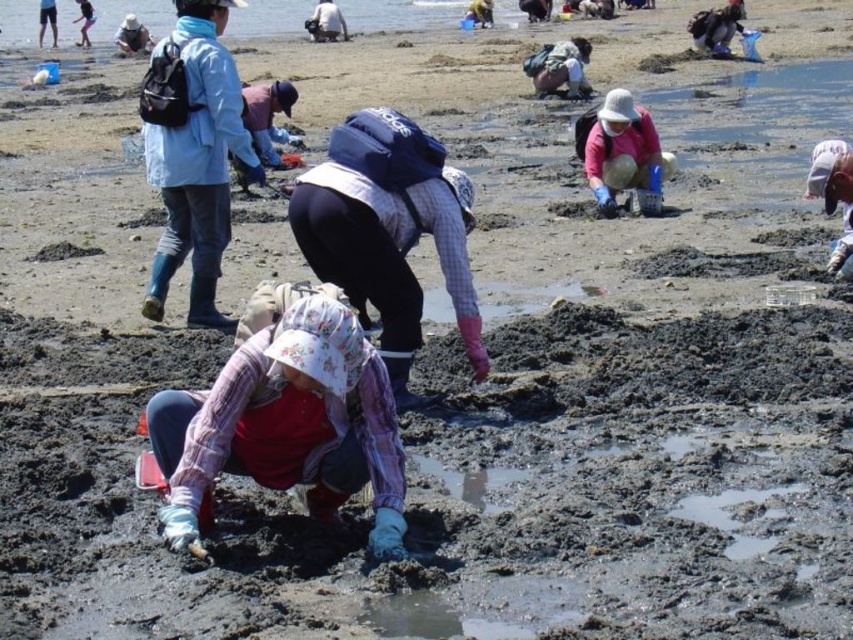
You are a photographer trying to capture a closeup shot of the plaid fabric hat at center and the plaid fabric shirt at center. Since you want both items to appear equally sized in the photo, which object should you move closer to the camera?

The plaid fabric hat at center is wider than the plaid fabric shirt at center. To make them appear the same size in the photo, you should move the plaid fabric shirt at center closer to the camera than the plaid fabric hat at center.

You are a photographer trying to capture both the plaid fabric shirt at center and the light blue fabric jacket at upper left in the same frame. Based on their positions, which one should you focus on first to ensure both are in the frame?

The plaid fabric shirt at center is positioned on the right side of light blue fabric jacket at upper left, so you should focus on the light blue fabric jacket at upper left first to ensure both are in the frame.